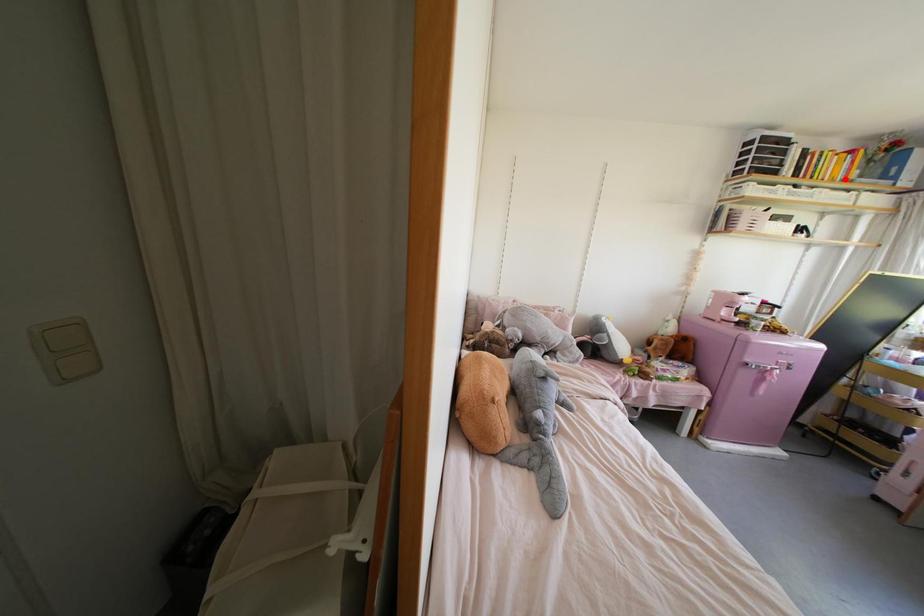
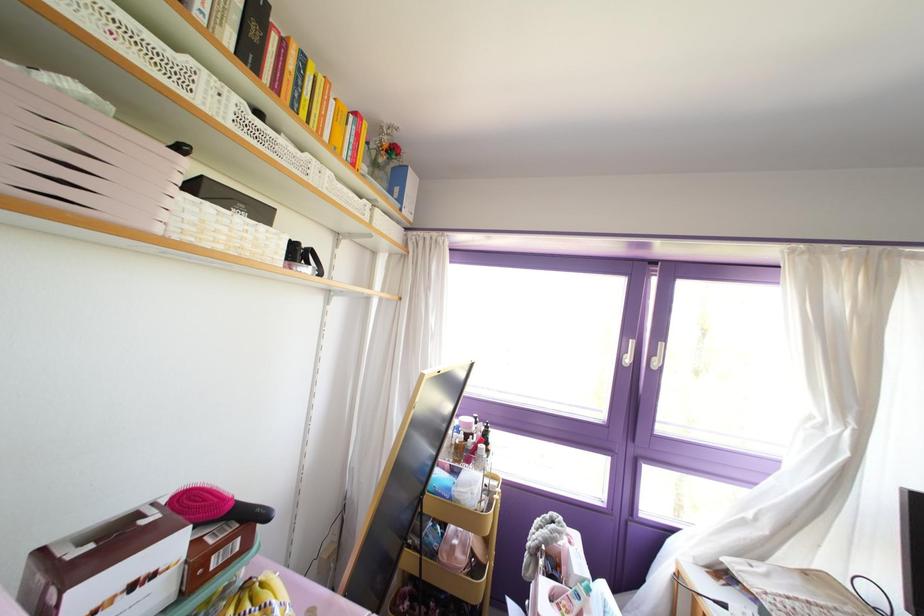
Locate, in the second image, the point that corresponds to the highlighted location in the first image.

(351, 164)